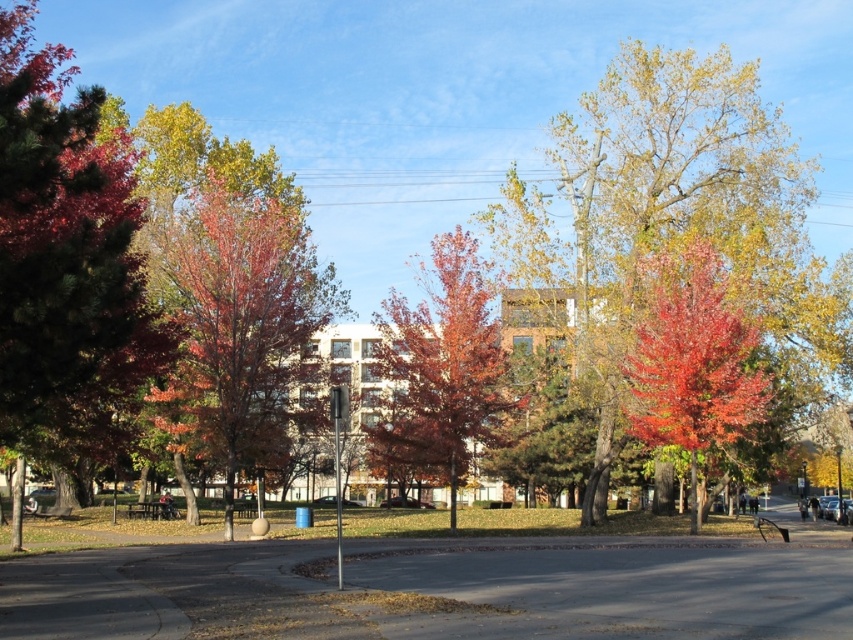
Who is positioned more to the right, shiny red leaves at left or reddish-brown bark tree at center?

From the viewer's perspective, shiny red leaves at left appears more on the right side.

Does shiny red leaves at left have a lesser height compared to reddish-brown bark tree at center?

Yes.

What do you see at coordinates (56, 230) in the screenshot?
I see `shiny red leaves at left` at bounding box center [56, 230].

Locate an element on the screen. The width and height of the screenshot is (853, 640). shiny red leaves at left is located at coordinates (56, 230).

Between shiny red leaves at left and matte red tree at center, which one is positioned higher?

shiny red leaves at left is higher up.

Does point (48, 241) come in front of point (422, 333)?

Yes, point (48, 241) is closer to viewer.

This screenshot has height=640, width=853. Identify the location of shiny red leaves at left. (56, 230).

Does reddish-brown bark tree at center have a larger size compared to matte red tree at center?

Indeed, reddish-brown bark tree at center has a larger size compared to matte red tree at center.

Does point (247, 228) lie in front of point (463, 300)?

No, (247, 228) is behind (463, 300).

Which is behind, point (310, 284) or point (378, 353)?

Point (310, 284)

You are a GUI agent. You are given a task and a screenshot of the screen. Output one action in this format:
    pyautogui.click(x=<x>, y=<y>)
    Task: Click on the reddish-brown bark tree at center
    
    Given the screenshot: What is the action you would take?
    pyautogui.click(x=239, y=326)